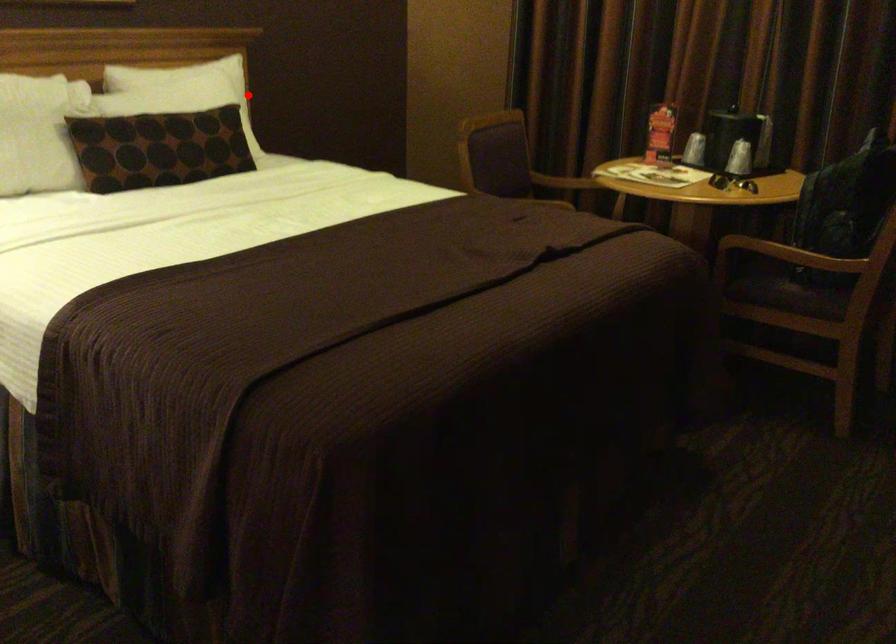
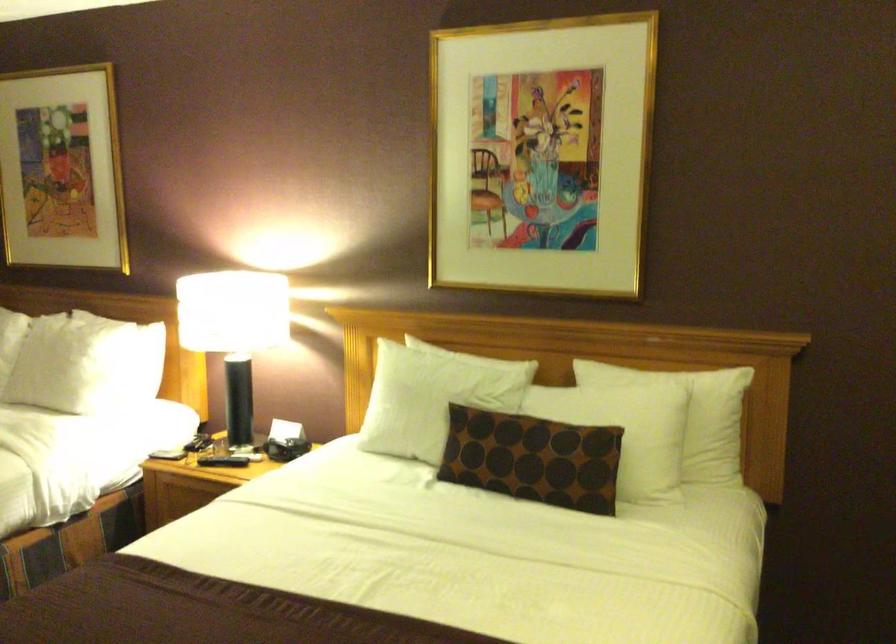
Question: I am providing you with two images of the same scene from different viewpoints. In image1, a red point is highlighted. Considering the same 3D point in image2, which of the following is correct?

Choices:
 (A) It is closer
 (B) It is farther

Answer: (A)